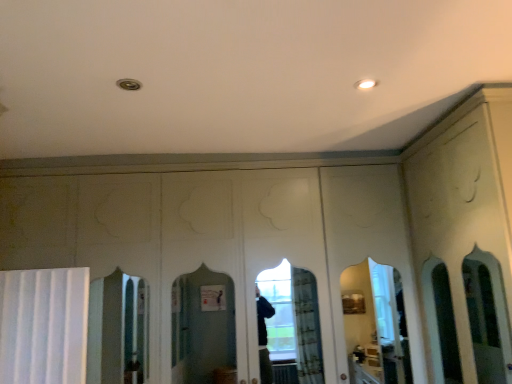
The image size is (512, 384). What do you see at coordinates (44, 326) in the screenshot?
I see `white fabric shower curtain at lower left` at bounding box center [44, 326].

Locate an element on the screen. white fabric shower curtain at lower left is located at coordinates (44, 326).

Locate an element on the screen. white fabric shower curtain at lower left is located at coordinates (44, 326).